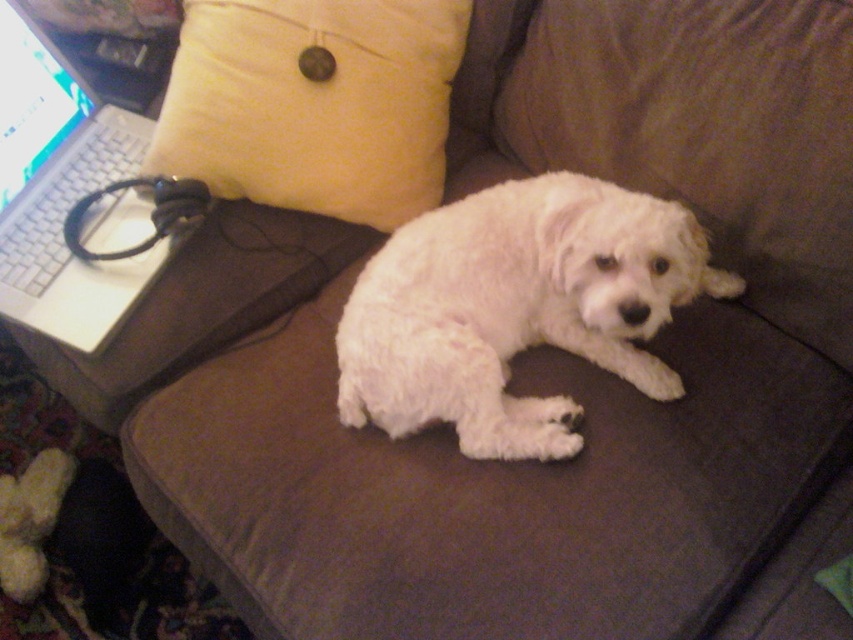
You are a dog owner who wants to place a treat between the yellow soft pillow at upper left and the white plastic laptop at left. Based on their positions, which object should you place the treat closer to in order for it to be between them?

The yellow soft pillow at upper left is to the right of the white plastic laptop at left. To place the treat between them, you should position it closer to the white plastic laptop at left since the pillow is on the right side of the laptop.

You are trying to locate the point with coordinates (515, 308) in the image. Based on the scene description, where would this point be located?

The point with coordinates (515, 308) is located on the white fluffy dog at center.